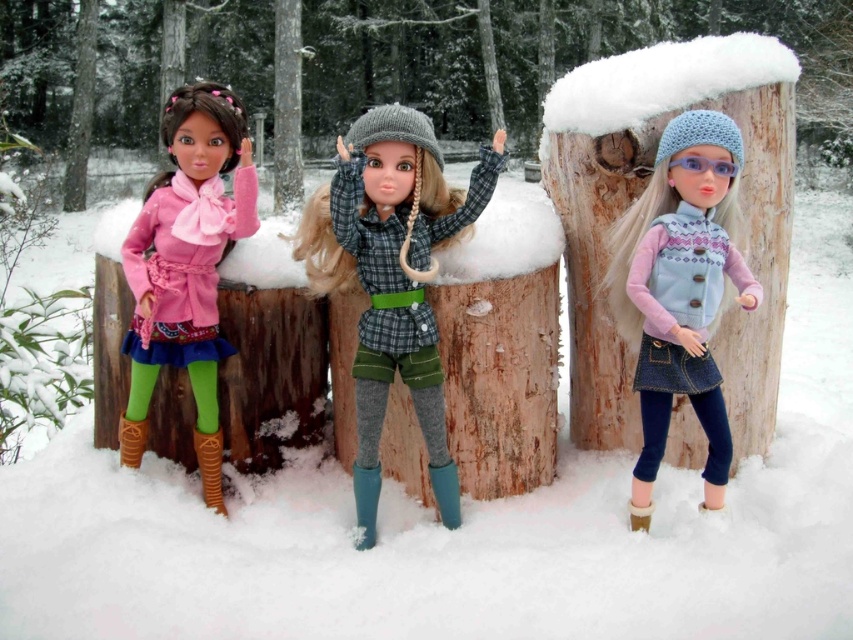
Who is positioned more to the right, checkered fabric shirt at center or denim skirt at center?

denim skirt at center is more to the right.

Does point (412, 388) come behind point (653, 392)?

Yes, it is behind point (653, 392).

Does point (405, 234) come closer to viewer compared to point (689, 304)?

No, (405, 234) is further to viewer.

Locate an element on the screen. Image resolution: width=853 pixels, height=640 pixels. checkered fabric shirt at center is located at coordinates (393, 278).

Can you confirm if checkered fabric shirt at center is positioned to the left of brown wood tree trunk at center?

In fact, checkered fabric shirt at center is to the right of brown wood tree trunk at center.

Is checkered fabric shirt at center above brown wood tree trunk at center?

Actually, checkered fabric shirt at center is below brown wood tree trunk at center.

Find the location of a particular element. checkered fabric shirt at center is located at coordinates (393, 278).

Between denim skirt at center and matte pink coat at left, which one is positioned higher?

matte pink coat at left

Does denim skirt at center have a smaller size compared to matte pink coat at left?

Indeed, denim skirt at center has a smaller size compared to matte pink coat at left.

Who is more forward, (x=618, y=305) or (x=154, y=250)?

Point (x=154, y=250) is in front.

The width and height of the screenshot is (853, 640). I want to click on denim skirt at center, so click(680, 291).